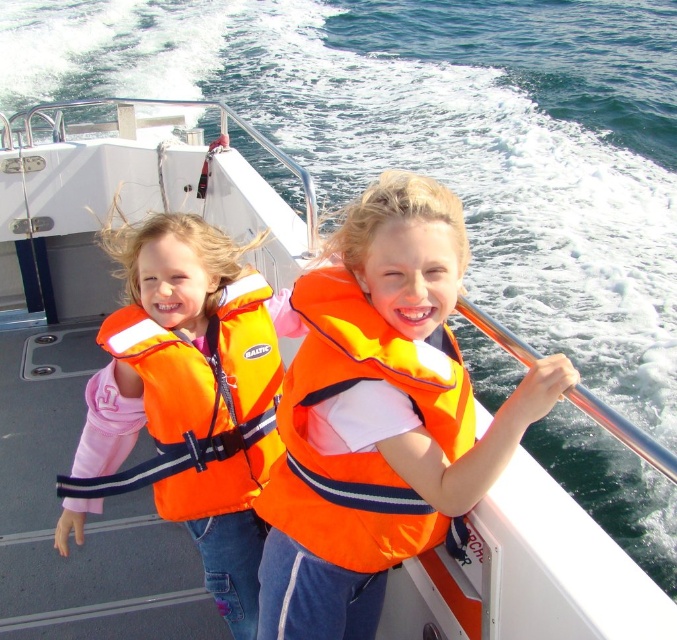
You are a safety inspector checking the distance between the orange life vest at left and the camera. According to safety regulations, the minimum distance required is 2 meters. Is the current distance compliant?

The distance between the orange life vest at left and the camera is 2.29 meters, which exceeds the minimum requirement of 2 meters, so it is compliant.

You are a safety inspector checking the boat for proper life vest placement. You notice two orange fabric life vests on the boat. According to safety regulations, life vests must be easily accessible and not obstructed by other items. Based on their positions, can you determine if the orange fabric life vest at center and the orange fabric life jacket at left are properly positioned?

The orange fabric life vest at center is in front of the orange fabric life jacket at left, meaning it may be blocking access to the one on the left. This could violate safety regulations as they should not obstruct each other. Both should be accessible without hindrance.